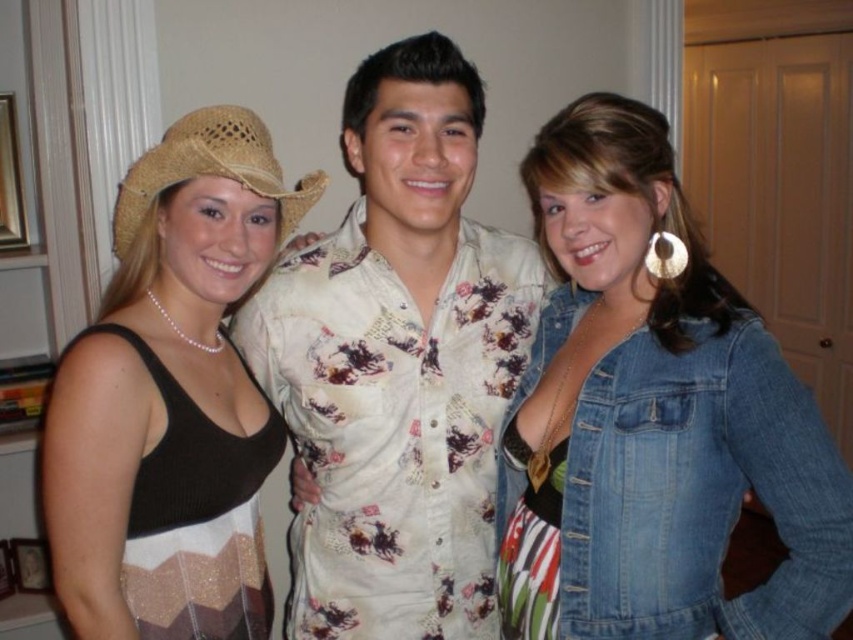
Is point (679, 612) farther from viewer compared to point (239, 248)?

That is True.

This screenshot has height=640, width=853. Describe the element at coordinates (653, 419) in the screenshot. I see `denim jacket at lower right` at that location.

I want to click on denim jacket at lower right, so click(653, 419).

Between point (389, 372) and point (236, 593), which one is positioned in front?

Point (236, 593) is in front.

Is white printed shirt at center positioned behind matte straw cowboy hat at left?

Yes.

Is point (523, 269) positioned behind point (45, 499)?

Yes.

At what (x,y) coordinates should I click in order to perform the action: click on white printed shirt at center. Please return your answer as a coordinate pair (x, y). The height and width of the screenshot is (640, 853). Looking at the image, I should click on (397, 364).

Is point (107, 344) positioned after point (196, 124)?

That is False.

Is point (192, 497) less distant than point (227, 140)?

Yes, point (192, 497) is in front of point (227, 140).

Does point (112, 476) lie behind point (238, 172)?

No, (112, 476) is in front of (238, 172).

Where is `matte straw cowboy hat at left`? The width and height of the screenshot is (853, 640). matte straw cowboy hat at left is located at coordinates (171, 397).